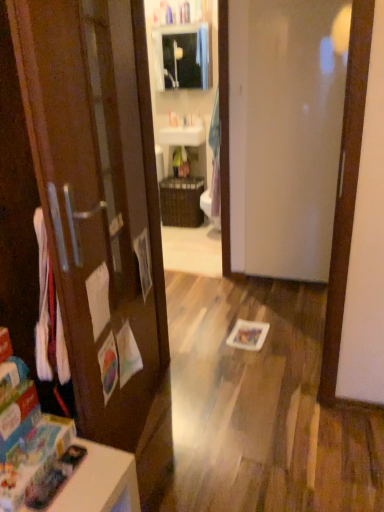
Where is `free location to the left of white glossy door at center`? free location to the left of white glossy door at center is located at coordinates (239, 290).